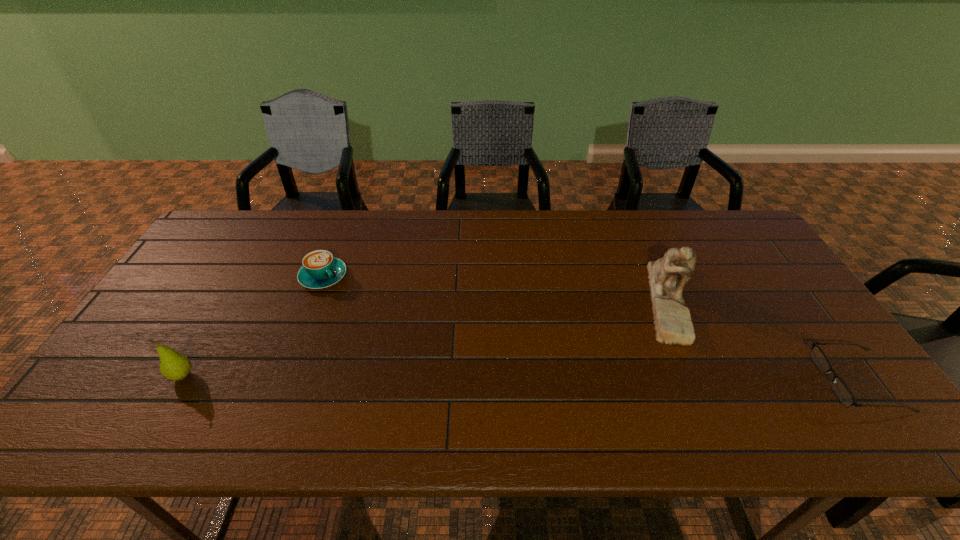
Identify the location of free space located on the front-facing side of the rightmost object. Image resolution: width=960 pixels, height=540 pixels. (705, 381).

Locate an element on the screen. Image resolution: width=960 pixels, height=540 pixels. free point located 0.240m on the front-facing side of the rightmost object is located at coordinates (726, 381).

At what (x,y) coordinates should I click in order to perform the action: click on vacant space positioned on the front-facing side of the third object from left to right. Please return your answer as a coordinate pair (x, y). Looking at the image, I should click on (594, 365).

You are a GUI agent. You are given a task and a screenshot of the screen. Output one action in this format:
    pyautogui.click(x=<x>, y=<y>)
    Task: Click on the free space located on the front-facing side of the third object from left to right
    The width and height of the screenshot is (960, 540).
    Given the screenshot: What is the action you would take?
    pyautogui.click(x=637, y=336)

You are a GUI agent. You are given a task and a screenshot of the screen. Output one action in this format:
    pyautogui.click(x=<x>, y=<y>)
    Task: Click on the free region located 0.400m on the front-facing side of the third object from left to right
    
    Given the screenshot: What is the action you would take?
    pyautogui.click(x=542, y=400)

You are a GUI agent. You are given a task and a screenshot of the screen. Output one action in this format:
    pyautogui.click(x=<x>, y=<y>)
    Task: Click on the free space located with the handle on the right side of the second object from left to right
    
    Given the screenshot: What is the action you would take?
    pos(420,371)

This screenshot has height=540, width=960. Identify the location of vacant space located 0.070m with the handle on the right side of the second object from left to right. (348, 301).

Identify the location of blank area located 0.120m with the handle on the right side of the second object from left to right. The image size is (960, 540). (358, 310).

Where is `pear that is at the near edge`? The width and height of the screenshot is (960, 540). pear that is at the near edge is located at coordinates (174, 366).

I want to click on spectacles located in the near edge section of the desktop, so click(841, 390).